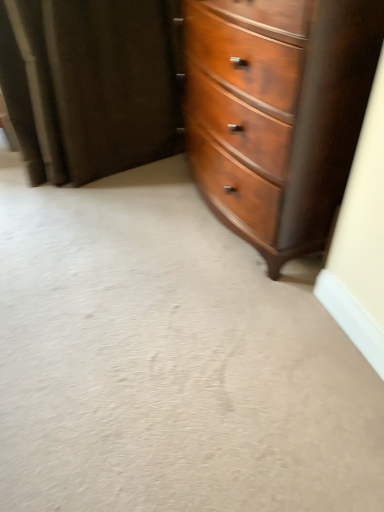
Question: From the image's perspective, does shiny brown wood chest of drawers at center appear higher than velvet dark brown curtain at upper left?

Choices:
 (A) no
 (B) yes

Answer: (A)

Question: From a real-world perspective, is shiny brown wood chest of drawers at center positioned under velvet dark brown curtain at upper left based on gravity?

Choices:
 (A) yes
 (B) no

Answer: (B)

Question: Does shiny brown wood chest of drawers at center come behind velvet dark brown curtain at upper left?

Choices:
 (A) yes
 (B) no

Answer: (B)

Question: Is shiny brown wood chest of drawers at center not close to velvet dark brown curtain at upper left?

Choices:
 (A) no
 (B) yes

Answer: (A)

Question: Is shiny brown wood chest of drawers at center at the left side of velvet dark brown curtain at upper left?

Choices:
 (A) yes
 (B) no

Answer: (B)

Question: Considering the relative sizes of shiny brown wood chest of drawers at center and velvet dark brown curtain at upper left in the image provided, is shiny brown wood chest of drawers at center shorter than velvet dark brown curtain at upper left?

Choices:
 (A) no
 (B) yes

Answer: (A)

Question: Considering the relative sizes of velvet dark brown curtain at upper left and shiny brown wood chest of drawers at center in the image provided, is velvet dark brown curtain at upper left taller than shiny brown wood chest of drawers at center?

Choices:
 (A) yes
 (B) no

Answer: (B)

Question: From the image's perspective, is velvet dark brown curtain at upper left under shiny brown wood chest of drawers at center?

Choices:
 (A) yes
 (B) no

Answer: (B)

Question: Is velvet dark brown curtain at upper left thinner than shiny brown wood chest of drawers at center?

Choices:
 (A) yes
 (B) no

Answer: (A)

Question: From a real-world perspective, is velvet dark brown curtain at upper left on shiny brown wood chest of drawers at center?

Choices:
 (A) yes
 (B) no

Answer: (B)

Question: Is velvet dark brown curtain at upper left further to camera compared to shiny brown wood chest of drawers at center?

Choices:
 (A) no
 (B) yes

Answer: (B)

Question: Are velvet dark brown curtain at upper left and shiny brown wood chest of drawers at center making contact?

Choices:
 (A) no
 (B) yes

Answer: (A)

Question: From a real-world perspective, relative to velvet dark brown curtain at upper left, is shiny brown wood chest of drawers at center vertically above or below?

Choices:
 (A) above
 (B) below

Answer: (A)